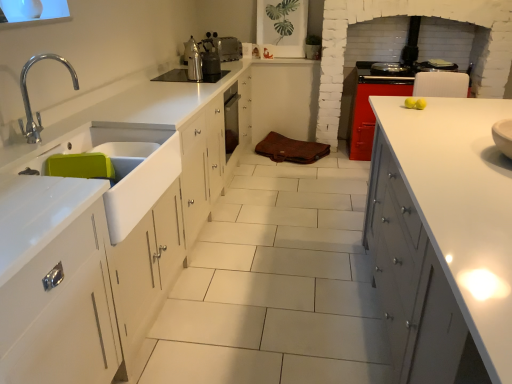
Question: From a real-world perspective, is metallic silver kettle at center, which is the 2th appliance in back-to-front order, positioned above or below white glossy sink at left?

Choices:
 (A) below
 (B) above

Answer: (B)

Question: In terms of size, does metallic silver kettle at center, which is the 2th appliance in back-to-front order, appear bigger or smaller than white glossy sink at left?

Choices:
 (A) big
 (B) small

Answer: (B)

Question: Estimate the real-world distances between objects in this image. Which object is closer to the black glass cooktop at upper center?

Choices:
 (A) silver metallic toaster at center, acting as the 1th appliance starting from the top
 (B) brown leather bag at center, which is the first cabinetry from top to bottom
 (C) white glossy sink at left
 (D) shiny metallic stove at upper right
 (E) metallic silver kettle at center, the 1th appliance viewed from the front

Answer: (E)

Question: Which object is positioned closest to the black glass cooktop at upper center?

Choices:
 (A) polished chrome tap at left
 (B) shiny metallic stove at upper right
 (C) white glossy sink at left
 (D) white glossy cabinet at right, marked as the 1th cabinetry in a front-to-back arrangement
 (E) metallic silver kettle at center, the 1th appliance viewed from the front

Answer: (E)